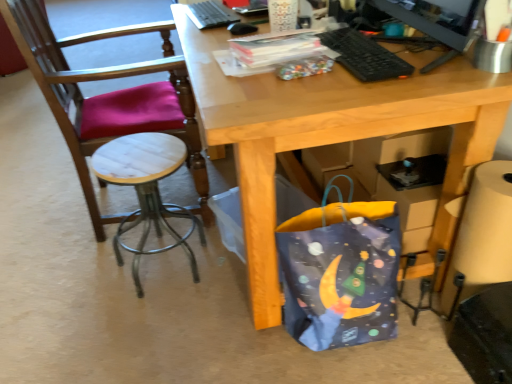
This screenshot has width=512, height=384. Identify the location of spots to the right of white marble stool at left. (224, 273).